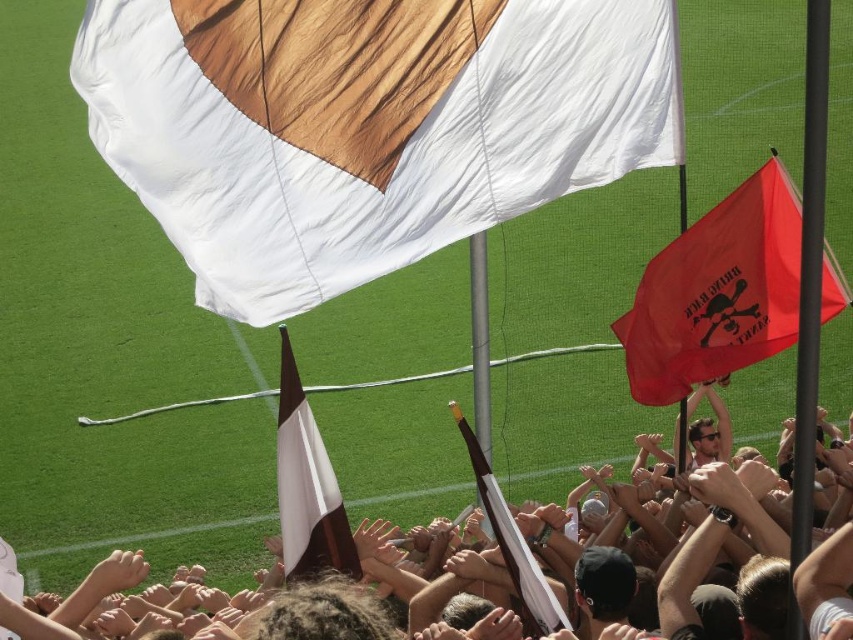
Measure the distance between white fabric flag at upper center and camera.

9.27 meters

Between point (421, 29) and point (717, 416), which one is positioned in front?

Point (421, 29)

Find the location of a particular element. The height and width of the screenshot is (640, 853). white fabric flag at upper center is located at coordinates tap(364, 125).

Does point (316, 429) come in front of point (512, 561)?

No.

Is brown/white fabric flag at center taller than white fabric flag at center?

Correct, brown/white fabric flag at center is much taller as white fabric flag at center.

Where is `brown/white fabric flag at center`? brown/white fabric flag at center is located at coordinates (306, 486).

You are a GUI agent. You are given a task and a screenshot of the screen. Output one action in this format:
    pyautogui.click(x=<x>, y=<y>)
    Task: Click on the brown/white fabric flag at center
    Image resolution: width=853 pixels, height=640 pixels.
    Given the screenshot: What is the action you would take?
    click(306, 486)

Between red fabric flag at right and brown/white fabric flag at center, which one has less height?

brown/white fabric flag at center is shorter.

Is point (698, 360) positioned in front of point (322, 492)?

No, it is behind (322, 492).

Find the location of a particular element. This screenshot has width=853, height=640. red fabric flag at right is located at coordinates click(x=717, y=292).